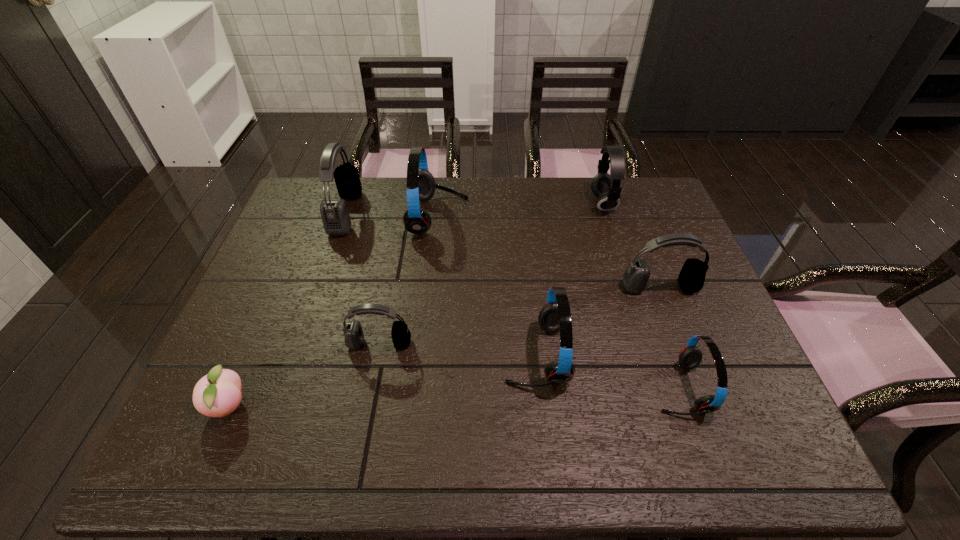
You are a GUI agent. You are given a task and a screenshot of the screen. Output one action in this format:
    pyautogui.click(x=<x>, y=<y>)
    Task: Click on the leftmost headset
    
    Given the screenshot: What is the action you would take?
    pyautogui.click(x=335, y=216)

Locate an element on the screen. Image resolution: width=960 pixels, height=540 pixels. the leftmost black headset is located at coordinates (335, 216).

Find the location of a particular element. This screenshot has height=540, width=960. the biggest red headset is located at coordinates (421, 186).

The height and width of the screenshot is (540, 960). Identify the location of the leftmost red headset. pyautogui.click(x=421, y=186).

This screenshot has height=540, width=960. Identify the location of black earphone. (606, 187).

Locate an element on the screen. The width and height of the screenshot is (960, 540). the fourth nearest headset is located at coordinates (691, 278).

Locate an element on the screen. The image size is (960, 540). the fourth farthest object is located at coordinates (x=691, y=278).

What are the coordinates of `the second biggest red headset` in the screenshot? It's located at (555, 315).

I want to click on the second red headset from left to right, so click(x=555, y=315).

Where is `the second black headset from right to left`? the second black headset from right to left is located at coordinates (354, 336).